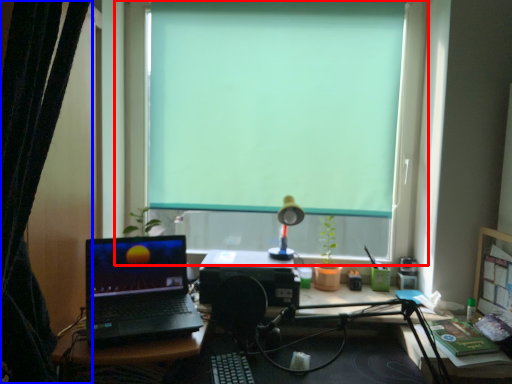
Question: Which point is further to the camera, window (highlighted by a red box) or curtain (highlighted by a blue box)?

Choices:
 (A) window
 (B) curtain

Answer: (A)